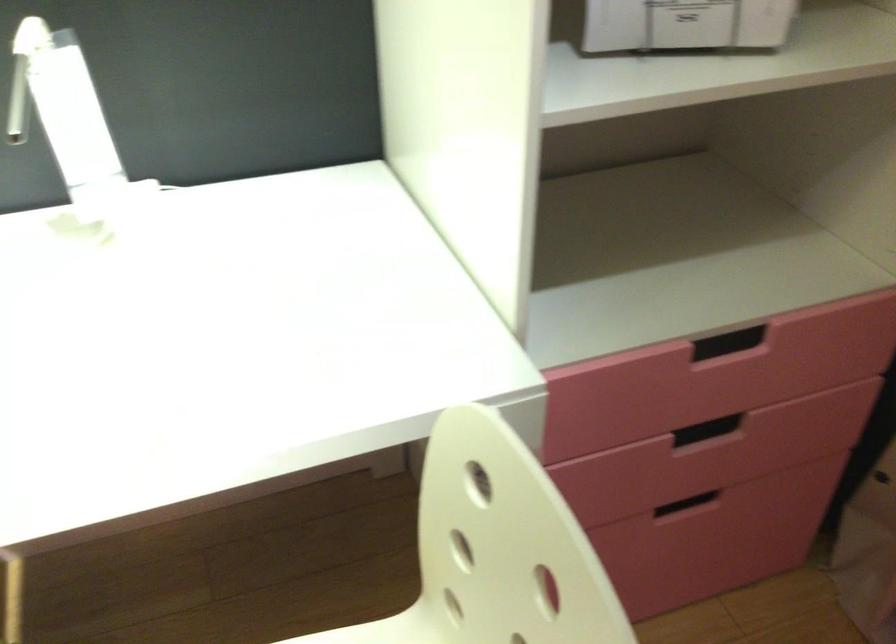
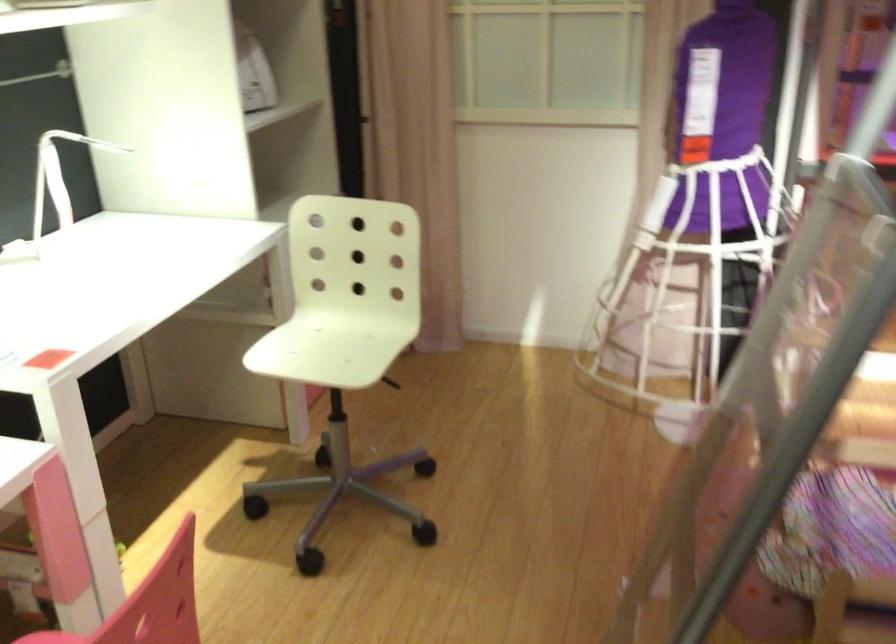
Question: I am providing you with two images of the same scene from different viewpoints. After the viewpoint changes to image2, which objects are now occluded?

Choices:
 (A) white chair sitting surface
 (B) recessed drawer handle
 (C) blue litter box
 (D) white desk lamp

Answer: (B)